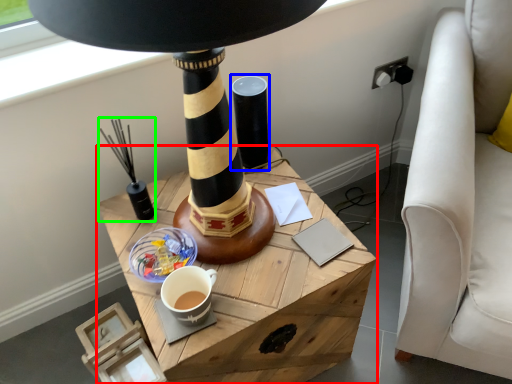
Question: Which object is positioned farthest from table (highlighted by a red box)? Select from candle holder (highlighted by a blue box) and candle holder (highlighted by a green box).

Choices:
 (A) candle holder
 (B) candle holder

Answer: (A)